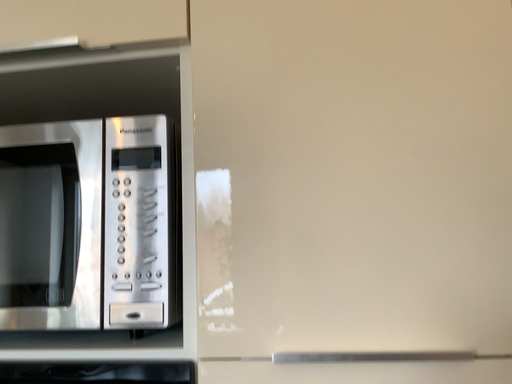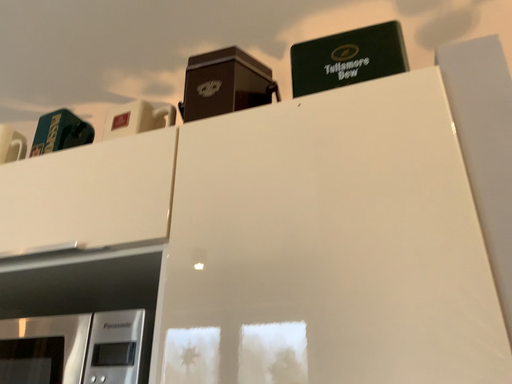
Question: Which way did the camera rotate in the video?

Choices:
 (A) rotated upward
 (B) rotated downward

Answer: (A)